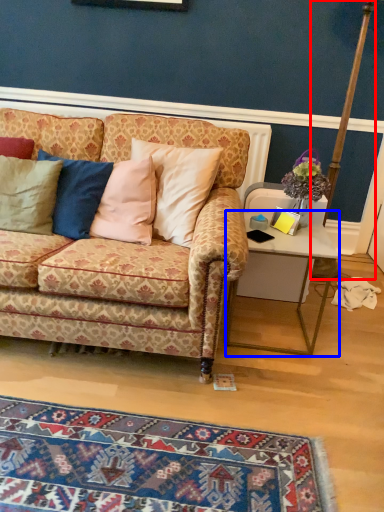
Question: Which object is further to the camera taking this photo, pole (highlighted by a red box) or desk (highlighted by a blue box)?

Choices:
 (A) pole
 (B) desk

Answer: (A)